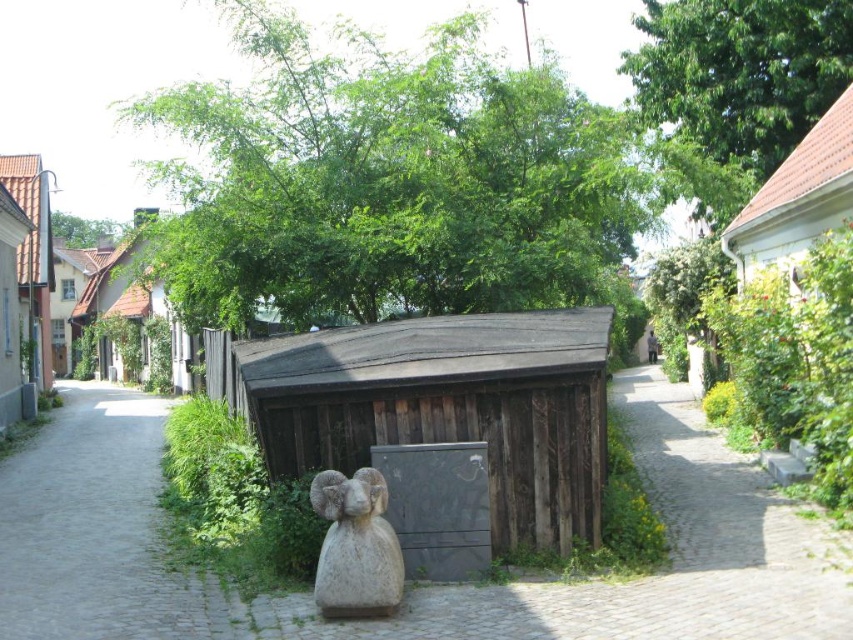
Question: Can you confirm if white stone ram at center is positioned to the left of wooden hut at upper left?

Choices:
 (A) yes
 (B) no

Answer: (B)

Question: Which point appears closest to the camera in this image?

Choices:
 (A) (474, 432)
 (B) (354, 513)

Answer: (B)

Question: Is dark brown wood at center to the left of green leafy tree at upper right from the viewer's perspective?

Choices:
 (A) no
 (B) yes

Answer: (B)

Question: Which object is the farthest from the green leafy tree at center?

Choices:
 (A) wooden shed at center
 (B) brown wooden hut at upper right

Answer: (B)

Question: Which of the following is the farthest from the observer?

Choices:
 (A) (779, 196)
 (B) (33, 416)

Answer: (B)

Question: Considering the relative positions of white stone ram at center and wooden hut at upper left in the image provided, where is white stone ram at center located with respect to wooden hut at upper left?

Choices:
 (A) left
 (B) right

Answer: (B)